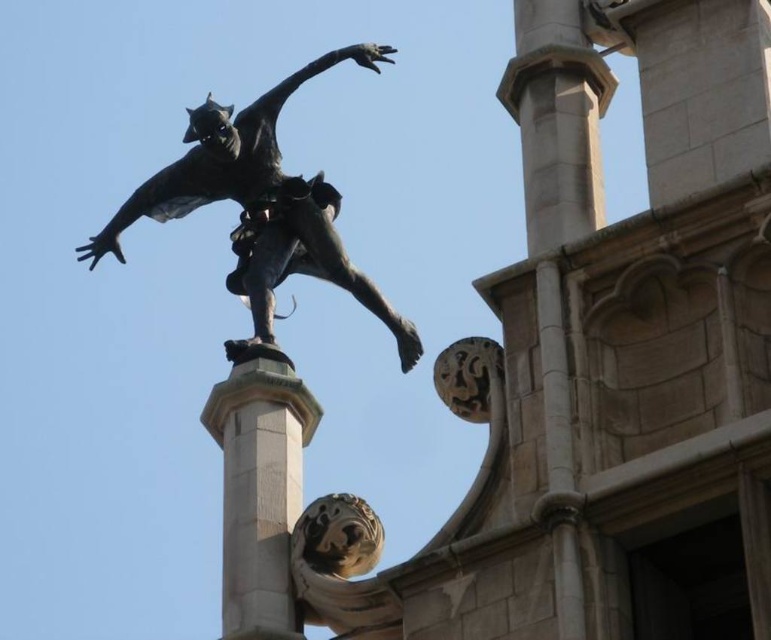
Is bronze statue at upper center wider than smooth stone pillar at center?

Yes.

Is bronze statue at upper center below smooth stone pillar at center?

Incorrect, bronze statue at upper center is not positioned below smooth stone pillar at center.

Does point (357, 285) come in front of point (241, 572)?

No.

Where is `bronze statue at upper center`? The width and height of the screenshot is (771, 640). bronze statue at upper center is located at coordinates (261, 205).